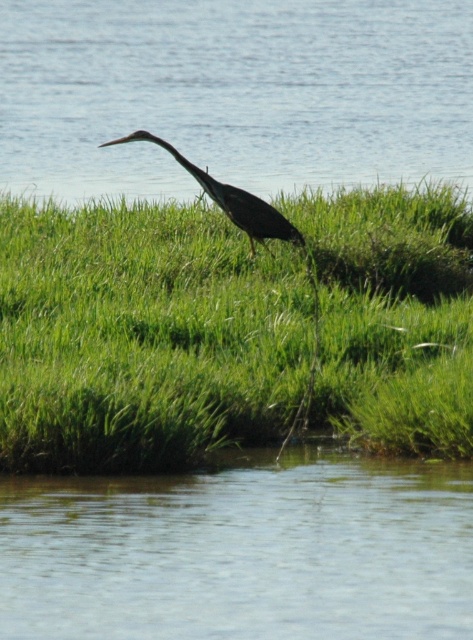
Question: Can you confirm if green grassy at center is thinner than clear blue water at center?

Choices:
 (A) yes
 (B) no

Answer: (A)

Question: Considering the relative positions of clear blue water at center and dark gray matte bird at center in the image provided, where is clear blue water at center located with respect to dark gray matte bird at center?

Choices:
 (A) right
 (B) left

Answer: (B)

Question: Among these points, which one is farthest from the camera?

Choices:
 (A) (194, 170)
 (B) (196, 108)
 (C) (218, 412)

Answer: (B)

Question: Which point appears closest to the camera in this image?

Choices:
 (A) (63, 141)
 (B) (181, 163)
 (C) (99, 228)

Answer: (B)

Question: Among these points, which one is nearest to the camera?

Choices:
 (A) (271, 212)
 (B) (379, 134)

Answer: (A)

Question: Does clear blue water at center appear under dark gray matte bird at center?

Choices:
 (A) yes
 (B) no

Answer: (B)